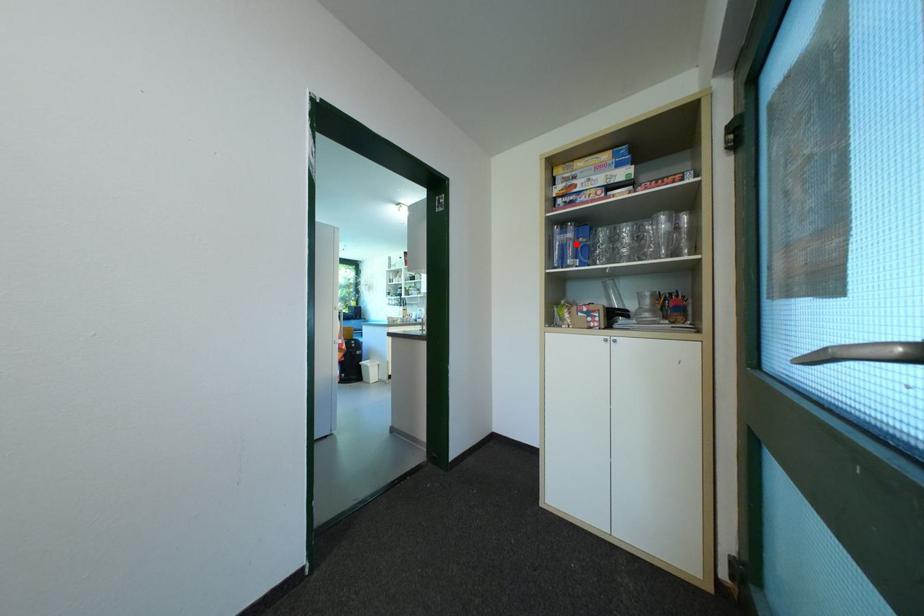
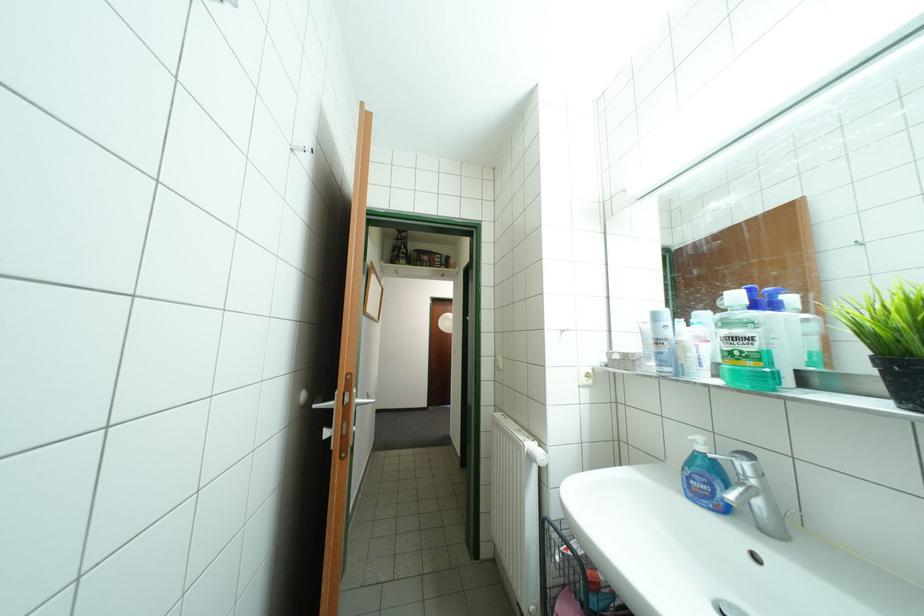
Question: I am providing you with two images of the same scene from different viewpoints. A red point is marked on the first image. Can you still see the location of the red point in image 2?

Choices:
 (A) Yes
 (B) No

Answer: (B)